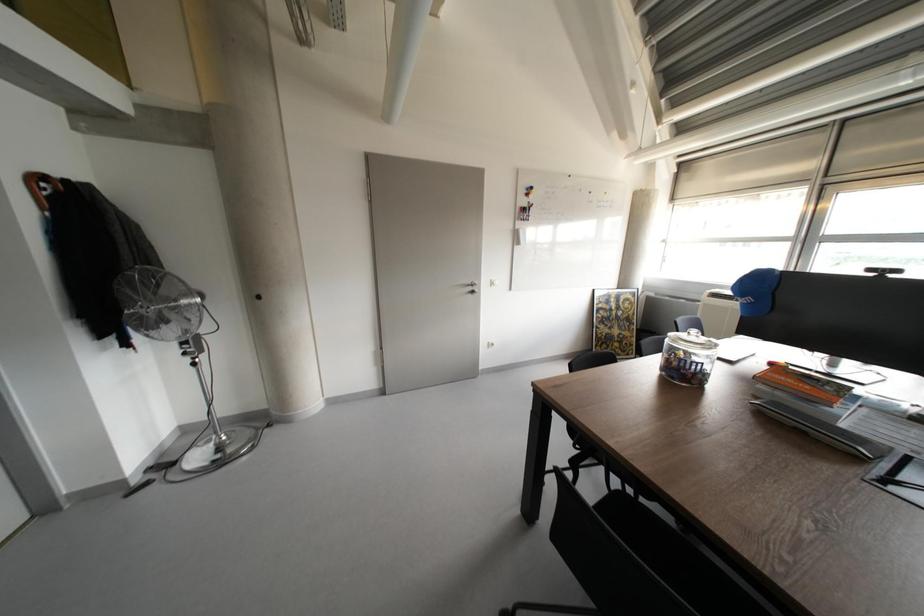
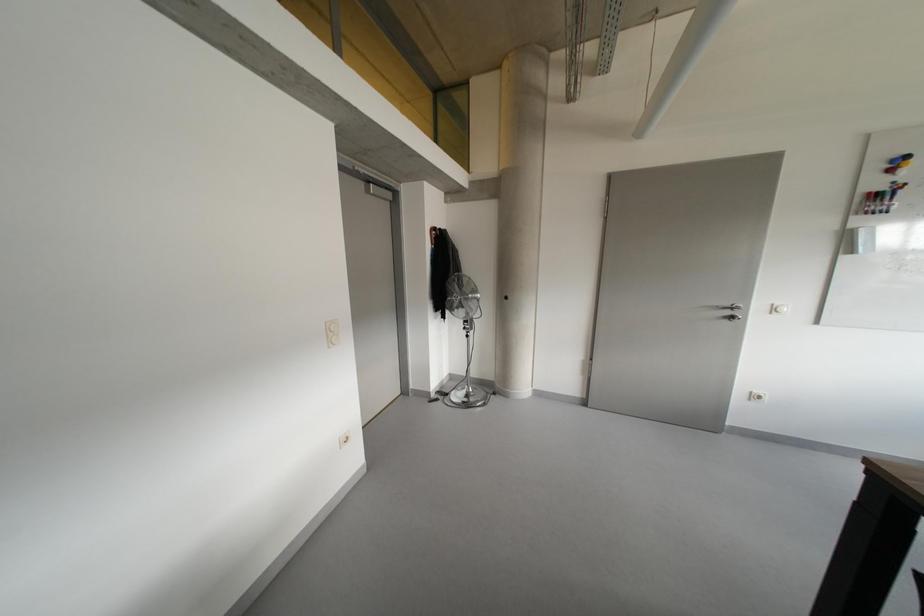
Question: The camera is either moving clockwise (left) or counter-clockwise (right) around the object. The first image is from the beginning of the video and the second image is from the end. Is the camera moving left or right when shooting the video?

Choices:
 (A) Left
 (B) Right

Answer: (B)